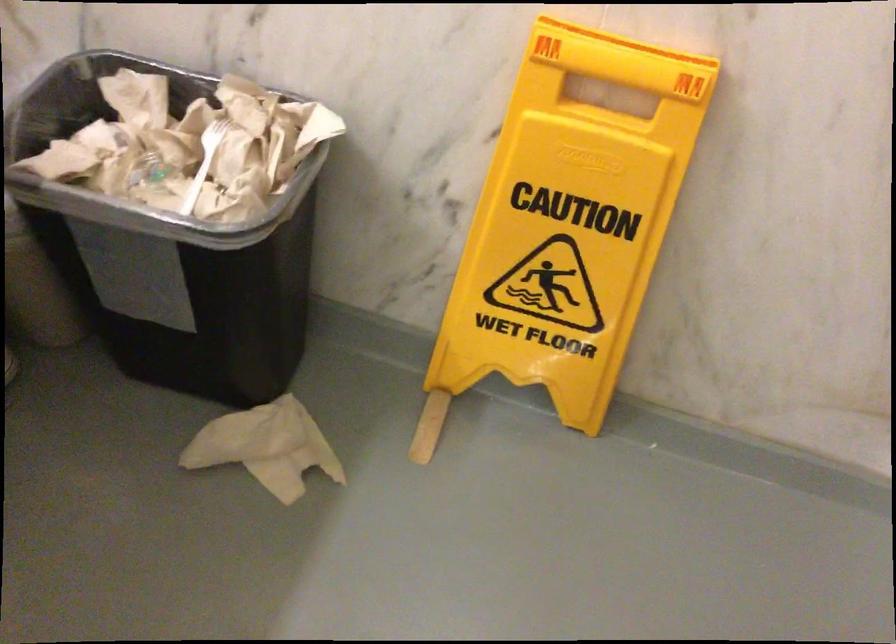
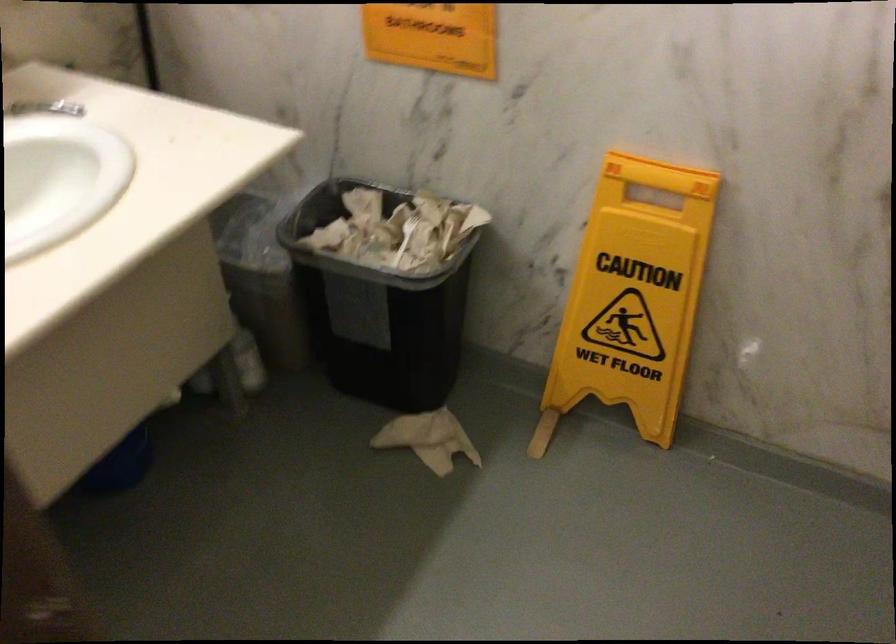
The point at (170, 272) is marked in the first image. Where is the corresponding point in the second image?

(376, 310)